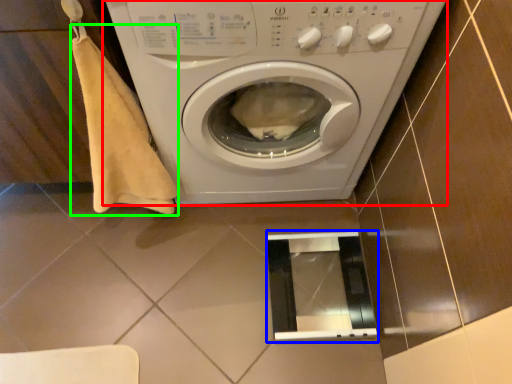
Question: Which is farther away from washing machine (highlighted by a red box)? screen door (highlighted by a blue box) or blanket (highlighted by a green box)?

Choices:
 (A) screen door
 (B) blanket

Answer: (A)